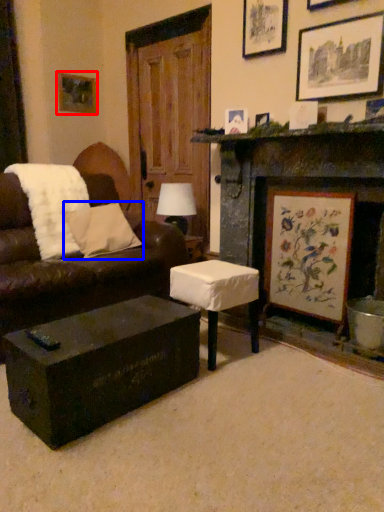
Question: Among these objects, which one is farthest to the camera, picture frame (highlighted by a red box) or pillow (highlighted by a blue box)?

Choices:
 (A) picture frame
 (B) pillow

Answer: (A)